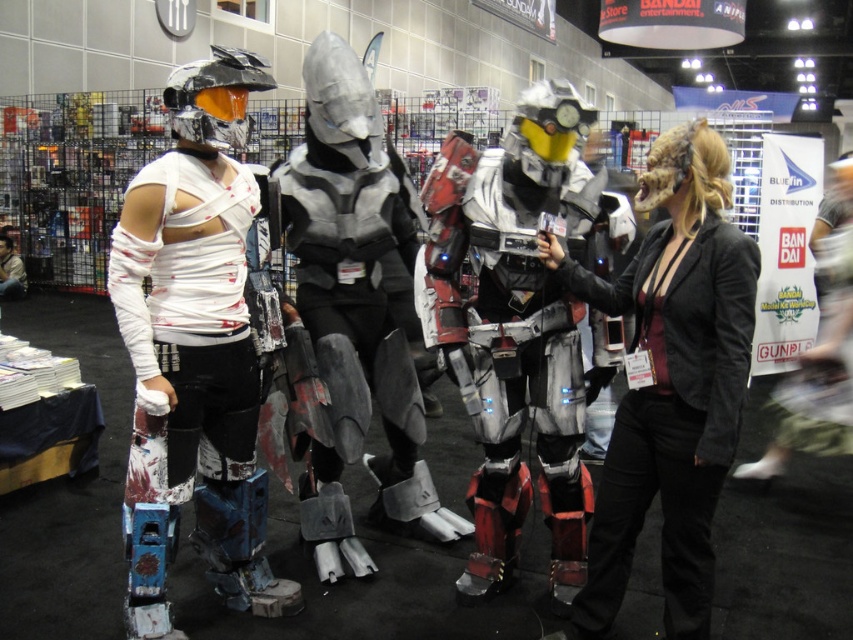
Looking at this image, does white bandaged armor at left appear under red and white metallic armor at center?

Yes.

The image size is (853, 640). Describe the element at coordinates (199, 326) in the screenshot. I see `white bandaged armor at left` at that location.

At what (x,y) coordinates should I click in order to perform the action: click on white bandaged armor at left. Please return your answer as a coordinate pair (x, y). Looking at the image, I should click on (199, 326).

Which of these two, white bandaged armor at left or silver metallic armor at center, stands shorter?

Standing shorter between the two is white bandaged armor at left.

Is white bandaged armor at left to the left of silver metallic armor at center from the viewer's perspective?

Correct, you'll find white bandaged armor at left to the left of silver metallic armor at center.

Is point (218, 324) positioned before point (390, 464)?

That is True.

Find the location of a particular element. white bandaged armor at left is located at coordinates [x=199, y=326].

Can you confirm if black leather jacket at center is positioned to the left of silver metallic armor at center?

In fact, black leather jacket at center is to the right of silver metallic armor at center.

Measure the distance between black leather jacket at center and silver metallic armor at center.

black leather jacket at center and silver metallic armor at center are 38.15 inches apart from each other.

Who is more distant from viewer, (727, 289) or (314, 188)?

Positioned behind is point (314, 188).

Locate an element on the screen. This screenshot has width=853, height=640. black leather jacket at center is located at coordinates (671, 381).